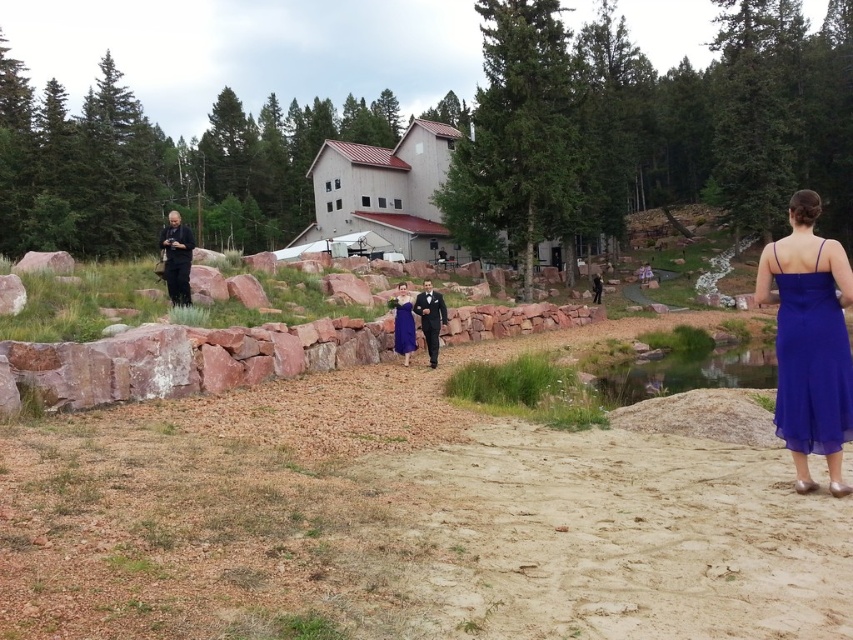
Can you confirm if dark blue uniform at left is smaller than shiny black suit at center?

Incorrect, dark blue uniform at left is not smaller in size than shiny black suit at center.

From the picture: Which is more to the right, dark blue uniform at left or shiny black suit at center?

From the viewer's perspective, shiny black suit at center appears more on the right side.

Describe the element at coordinates (177, 259) in the screenshot. I see `dark blue uniform at left` at that location.

Locate an element on the screen. The width and height of the screenshot is (853, 640). dark blue uniform at left is located at coordinates (177, 259).

Is shiny black suit at center to the left of royal blue chiffon dress at center from the viewer's perspective?

No, shiny black suit at center is not to the left of royal blue chiffon dress at center.

Does shiny black suit at center have a larger size compared to royal blue chiffon dress at center?

Yes, shiny black suit at center is bigger than royal blue chiffon dress at center.

Which is behind, point (431, 308) or point (405, 337)?

Positioned behind is point (405, 337).

Image resolution: width=853 pixels, height=640 pixels. Find the location of `shiny black suit at center`. shiny black suit at center is located at coordinates (430, 317).

Between clear water at center and shiny black suit at center, which one appears on the right side from the viewer's perspective?

clear water at center is more to the right.

Is point (769, 384) less distant than point (445, 317)?

No, (769, 384) is further to viewer.

Is point (723, 376) farther from viewer compared to point (437, 316)?

That is True.

This screenshot has width=853, height=640. In order to click on clear water at center in this screenshot , I will do `click(688, 372)`.